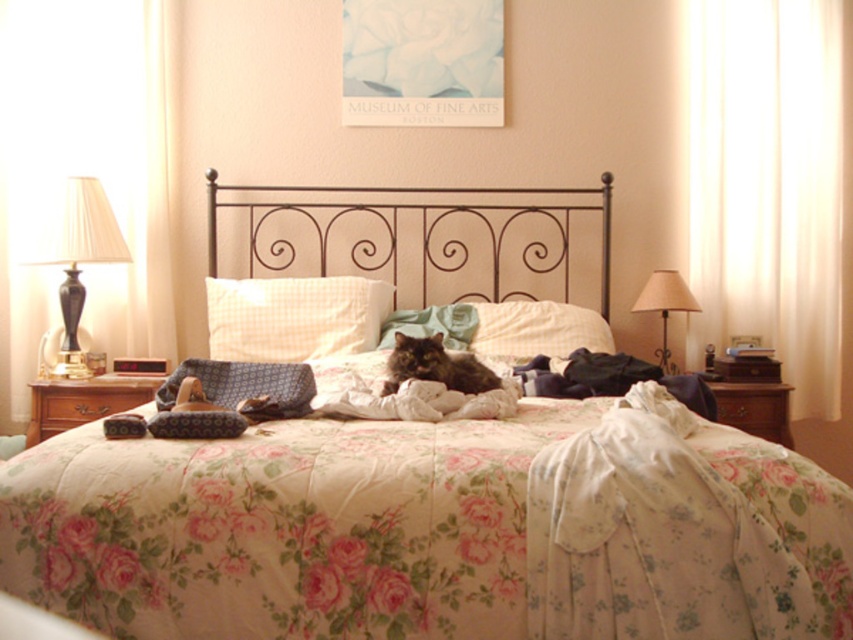
Question: Is fluffy brown cat at center above beige fabric lampshade at right?

Choices:
 (A) no
 (B) yes

Answer: (A)

Question: Can you confirm if matte paper poster at upper center is positioned above beige fabric lampshade at right?

Choices:
 (A) yes
 (B) no

Answer: (A)

Question: Which of the following is the farthest from the observer?

Choices:
 (A) pos(463,6)
 (B) pos(579,225)
 (C) pos(117,243)

Answer: (B)

Question: Which object is the farthest from the wooden dresser at right?

Choices:
 (A) floral cotton blanket at center
 (B) fluffy brown cat at center
 (C) white checkered pillow at center
 (D) matte paper poster at upper center

Answer: (D)

Question: Which point is closer to the camera?

Choices:
 (A) (643, 296)
 (B) (757, 396)

Answer: (B)

Question: Does matte black lamp at left have a greater width compared to wooden dresser at right?

Choices:
 (A) yes
 (B) no

Answer: (A)